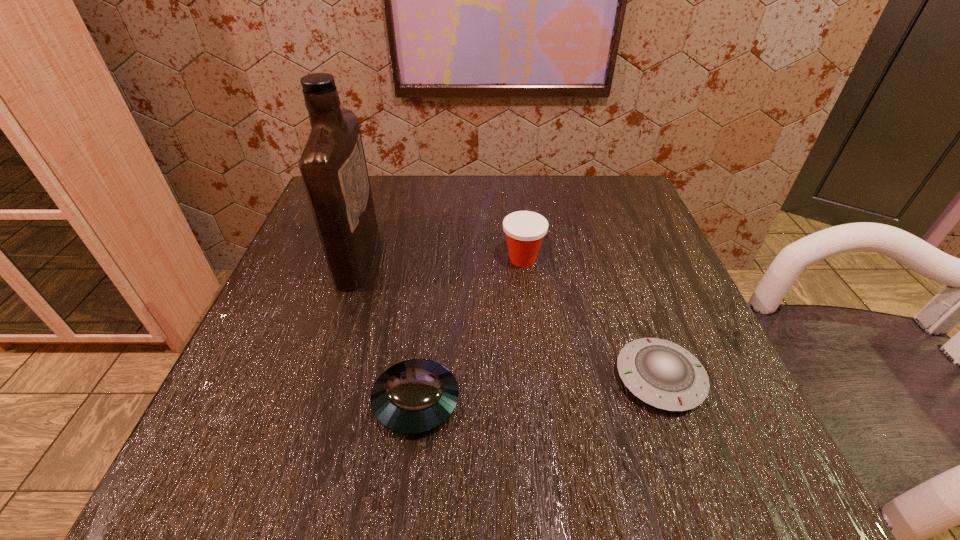
Identify the location of vacant space that satisfies the following two spatial constraints: 1. on the back side of the rightmost object; 2. on the left side of the second object from left to right. This screenshot has width=960, height=540. (419, 378).

Find the location of a particular element. This screenshot has height=540, width=960. blank space that satisfies the following two spatial constraints: 1. on the back side of the left saucer; 2. on the label side of the liquor is located at coordinates pos(434,255).

The image size is (960, 540). In order to click on vacant region that satisfies the following two spatial constraints: 1. on the back side of the shorter saucer; 2. on the label side of the liquor in this screenshot , I will do `click(615, 255)`.

Image resolution: width=960 pixels, height=540 pixels. Identify the location of vacant space that satisfies the following two spatial constraints: 1. on the label side of the tallest object; 2. on the left side of the right saucer. (318, 378).

Locate an element on the screen. This screenshot has height=540, width=960. free point that satisfies the following two spatial constraints: 1. on the label side of the third shortest object; 2. on the right side of the leftmost object is located at coordinates (357, 259).